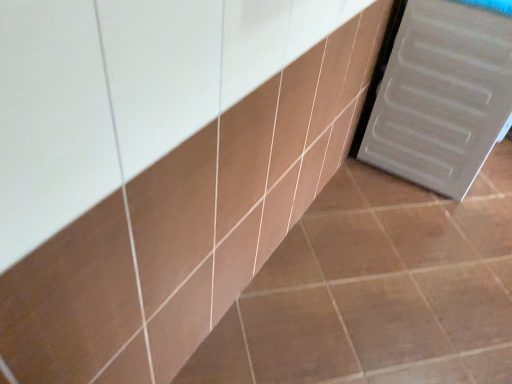
Describe the element at coordinates (442, 96) in the screenshot. The image size is (512, 384). I see `gray matte door at upper right` at that location.

The image size is (512, 384). I want to click on gray matte door at upper right, so click(x=442, y=96).

Locate an element on the screen. The image size is (512, 384). gray matte door at upper right is located at coordinates coord(442,96).